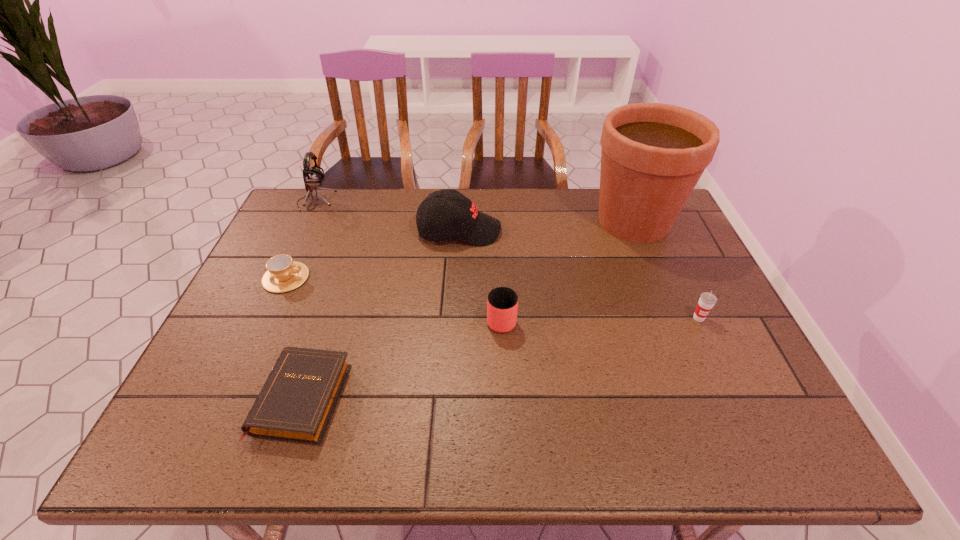
Locate an element on the screen. This screenshot has width=960, height=540. baseball cap situated at the far edge is located at coordinates (460, 218).

Find the location of a particular element. The image size is (960, 540). object that is at the near edge is located at coordinates (296, 404).

You are a GUI agent. You are given a task and a screenshot of the screen. Output one action in this format:
    pyautogui.click(x=<x>, y=<y>)
    Task: Click on the earphone that is at the left edge
    Image resolution: width=960 pixels, height=540 pixels.
    Given the screenshot: What is the action you would take?
    pyautogui.click(x=312, y=176)

The height and width of the screenshot is (540, 960). In order to click on cup that is at the left edge in this screenshot , I will do `click(283, 274)`.

This screenshot has width=960, height=540. What are the coordinates of `flowerpot that is at the right edge` in the screenshot? It's located at (653, 154).

Find the location of a particular element. This screenshot has width=960, height=540. cup located in the right edge section of the desktop is located at coordinates (707, 300).

Where is `object situated at the far left corner`? This screenshot has width=960, height=540. object situated at the far left corner is located at coordinates (312, 176).

Where is `object that is at the far right corner`? The height and width of the screenshot is (540, 960). object that is at the far right corner is located at coordinates (653, 154).

Identify the location of free region at the far edge of the desktop. The width and height of the screenshot is (960, 540). (548, 197).

Where is `vacant region at the near edge of the desktop`? The height and width of the screenshot is (540, 960). vacant region at the near edge of the desktop is located at coordinates (454, 442).